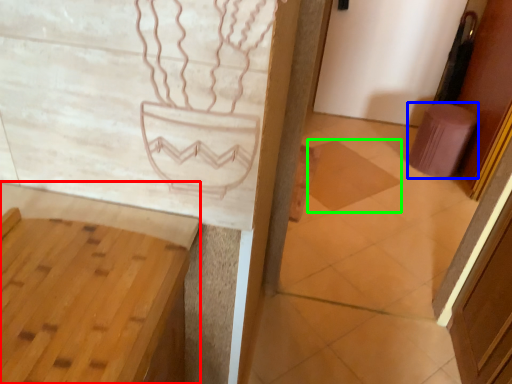
Question: Which object is positioned farthest from vanity (highlighted by a red box)? Select from stool (highlighted by a blue box) and tile (highlighted by a green box).

Choices:
 (A) stool
 (B) tile

Answer: (A)